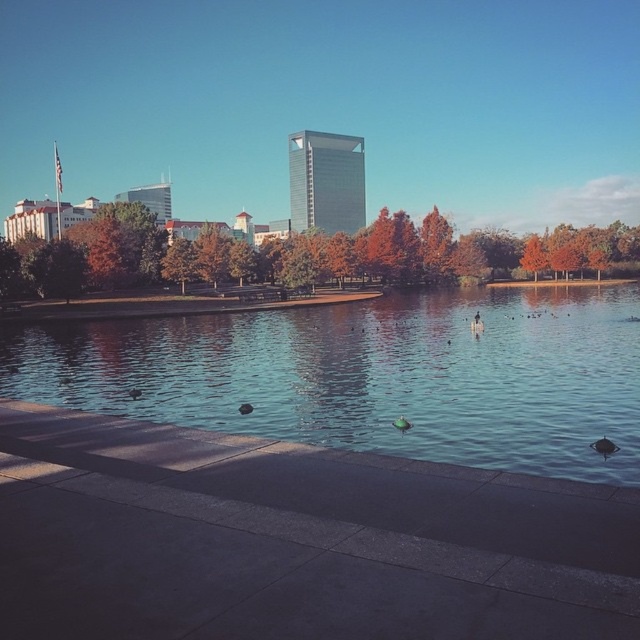
Question: Is orange matte tree at center to the right of green matte duck at center from the viewer's perspective?

Choices:
 (A) yes
 (B) no

Answer: (A)

Question: Does orange matte tree at upper center appear on the right side of brown fuzzy duck at center?

Choices:
 (A) no
 (B) yes

Answer: (A)

Question: Which object is the farthest from the green matte duck at center?

Choices:
 (A) orange matte tree at upper center
 (B) orange matte tree at center

Answer: (B)

Question: Can you confirm if orange matte tree at upper center is positioned below brown fuzzy duck at center?

Choices:
 (A) yes
 (B) no

Answer: (B)

Question: Estimate the real-world distances between objects in this image. Which object is farther from the orange matte tree at upper center?

Choices:
 (A) orange matte tree at center
 (B) clear water at center
 (C) brown fuzzy duck at center

Answer: (C)

Question: Which object is the farthest from the brown fuzzy duck at center?

Choices:
 (A) orange matte tree at upper center
 (B) green matte duck at center
 (C) orange matte tree at center

Answer: (C)